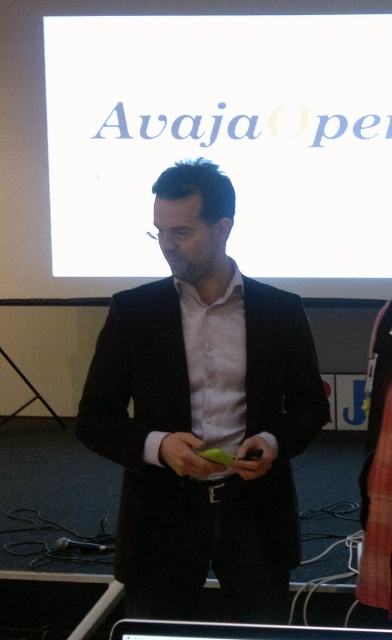
This screenshot has width=392, height=640. I want to click on white matte projection screen at upper center, so click(x=223, y=138).

Measure the distance between white matte projection screen at upper center and black matte suit at center.

white matte projection screen at upper center and black matte suit at center are 8.31 feet apart from each other.

What do you see at coordinates (223, 138) in the screenshot? The width and height of the screenshot is (392, 640). I see `white matte projection screen at upper center` at bounding box center [223, 138].

Identify the location of white matte projection screen at upper center. The height and width of the screenshot is (640, 392). [223, 138].